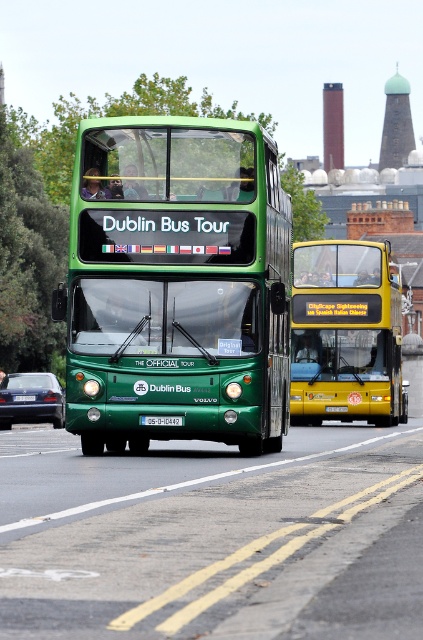
Does green matte double-decker bus at center have a lesser width compared to matte blue sedan at lower left?

No.

Can you confirm if green matte double-decker bus at center is taller than matte blue sedan at lower left?

Correct, green matte double-decker bus at center is much taller as matte blue sedan at lower left.

Is point (123, 163) positioned behind point (32, 385)?

No, it is in front of (32, 385).

Image resolution: width=423 pixels, height=640 pixels. What are the coordinates of `green matte double-decker bus at center` in the screenshot? It's located at (176, 285).

Is point (364, 333) positioned before point (178, 420)?

No, (364, 333) is further to viewer.

Who is shorter, yellow metallic bus at center or red plastic license plate at center?

With less height is red plastic license plate at center.

Measure the distance between yellow metallic bus at center and camera.

The distance of yellow metallic bus at center from camera is 34.52 meters.

The width and height of the screenshot is (423, 640). In order to click on yellow metallic bus at center in this screenshot , I will do `click(345, 333)`.

Is green matte double-decker bus at center shorter than yellow metallic bus at center?

Incorrect, green matte double-decker bus at center's height does not fall short of yellow metallic bus at center's.

Does point (197, 424) come behind point (304, 396)?

No.

Where is `green matte double-decker bus at center`? This screenshot has width=423, height=640. green matte double-decker bus at center is located at coordinates point(176,285).